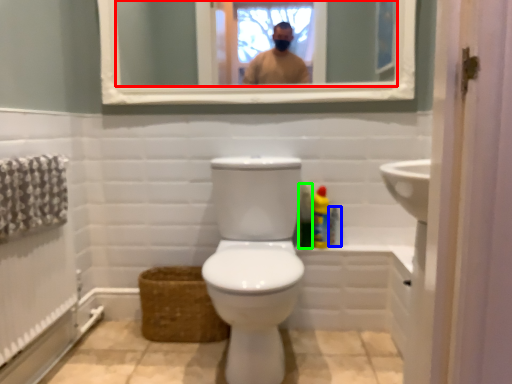
Question: Considering the real-world distances, which object is farthest from mirror (highlighted by a red box)? toiletry (highlighted by a blue box) or cleaning product (highlighted by a green box)?

Choices:
 (A) toiletry
 (B) cleaning product

Answer: (A)